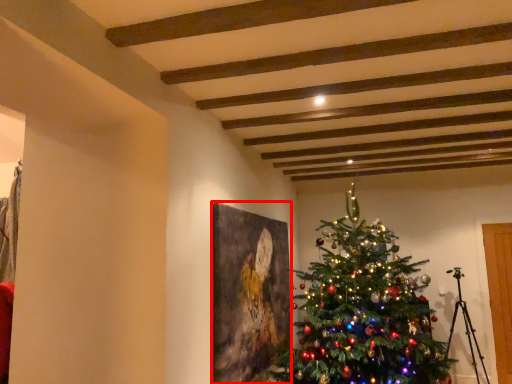
Question: From the image's perspective, considering the relative positions of picture frame (annotated by the red box) and christmas tree in the image provided, where is picture frame (annotated by the red box) located with respect to the staircase?

Choices:
 (A) above
 (B) below

Answer: (B)